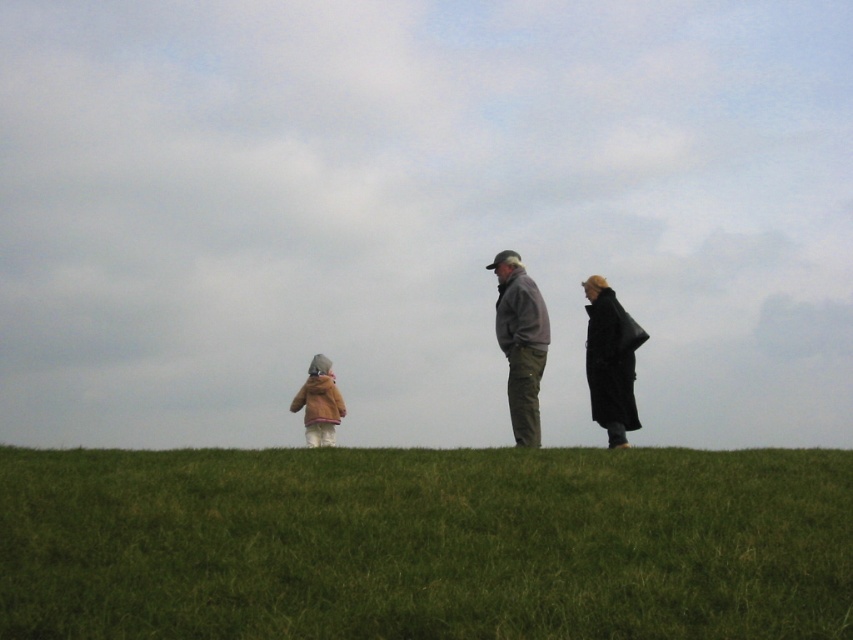
Question: From the image, what is the correct spatial relationship of matte gray jacket at center in relation to light brown fuzzy coat at lower left?

Choices:
 (A) above
 (B) below

Answer: (A)

Question: Which object appears closest to the camera in this image?

Choices:
 (A) matte gray jacket at center
 (B) light brown fuzzy coat at lower left
 (C) black leather coat at right
 (D) green grassy hill at lower center

Answer: (D)

Question: Does matte gray jacket at center lie in front of black leather coat at right?

Choices:
 (A) yes
 (B) no

Answer: (A)

Question: Does black leather coat at right have a larger size compared to light brown fuzzy coat at lower left?

Choices:
 (A) no
 (B) yes

Answer: (B)

Question: Which point is farther to the camera?

Choices:
 (A) (618, 305)
 (B) (610, 634)

Answer: (A)

Question: Which point is closer to the camera?

Choices:
 (A) black leather coat at right
 (B) matte gray jacket at center

Answer: (B)